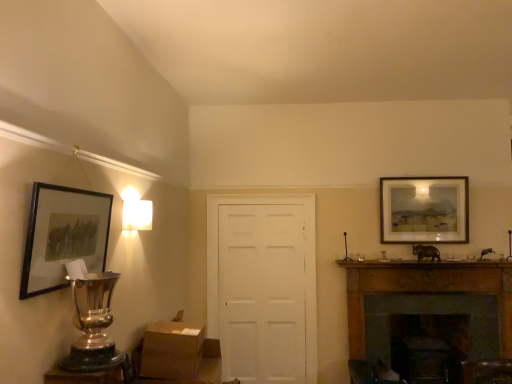
Question: Is matte black picture frame at left, the 2th picture frame positioned from the back, at the back of metallic trophy at lower left?

Choices:
 (A) no
 (B) yes

Answer: (A)

Question: Is metallic trophy at lower left shorter than matte black picture frame at left, arranged as the 1th picture frame when viewed from the front?

Choices:
 (A) no
 (B) yes

Answer: (B)

Question: Is metallic trophy at lower left at the left side of matte black picture frame at left, which ranks as the second picture frame in right-to-left order?

Choices:
 (A) yes
 (B) no

Answer: (B)

Question: Can you confirm if metallic trophy at lower left is positioned to the right of matte black picture frame at left, which ranks as the second picture frame in right-to-left order?

Choices:
 (A) no
 (B) yes

Answer: (B)

Question: From the image's perspective, would you say metallic trophy at lower left is shown under matte black picture frame at left, the 2th picture frame positioned from the back?

Choices:
 (A) yes
 (B) no

Answer: (A)

Question: Considering the relative positions of white matte door at center and brown cardboard box at lower center in the image provided, is white matte door at center to the left or to the right of brown cardboard box at lower center?

Choices:
 (A) left
 (B) right

Answer: (B)

Question: In terms of width, does white matte door at center look wider or thinner when compared to brown cardboard box at lower center?

Choices:
 (A) wide
 (B) thin

Answer: (B)

Question: Considering the positions of point (219, 236) and point (143, 334), is point (219, 236) closer or farther from the camera than point (143, 334)?

Choices:
 (A) closer
 (B) farther

Answer: (B)

Question: Considering their positions, is white matte door at center located in front of or behind brown cardboard box at lower center?

Choices:
 (A) front
 (B) behind

Answer: (B)

Question: Based on their positions, is metallic trophy at lower left located to the left or right of matte black picture frame at left, the 2th picture frame positioned from the back?

Choices:
 (A) left
 (B) right

Answer: (B)

Question: Do you think metallic trophy at lower left is within matte black picture frame at left, the 2th picture frame positioned from the back, or outside of it?

Choices:
 (A) inside
 (B) outside

Answer: (B)

Question: From the image's perspective, is metallic trophy at lower left above or below matte black picture frame at left, which ranks as the second picture frame in right-to-left order?

Choices:
 (A) below
 (B) above

Answer: (A)

Question: Considering the positions of metallic trophy at lower left and matte black picture frame at left, arranged as the 1th picture frame when viewed from the front, in the image, is metallic trophy at lower left wider or thinner than matte black picture frame at left, arranged as the 1th picture frame when viewed from the front,?

Choices:
 (A) wide
 (B) thin

Answer: (A)

Question: Is brown cardboard box at lower center taller or shorter than metallic trophy at lower left?

Choices:
 (A) tall
 (B) short

Answer: (A)

Question: Is brown cardboard box at lower center spatially inside metallic trophy at lower left, or outside of it?

Choices:
 (A) outside
 (B) inside

Answer: (A)